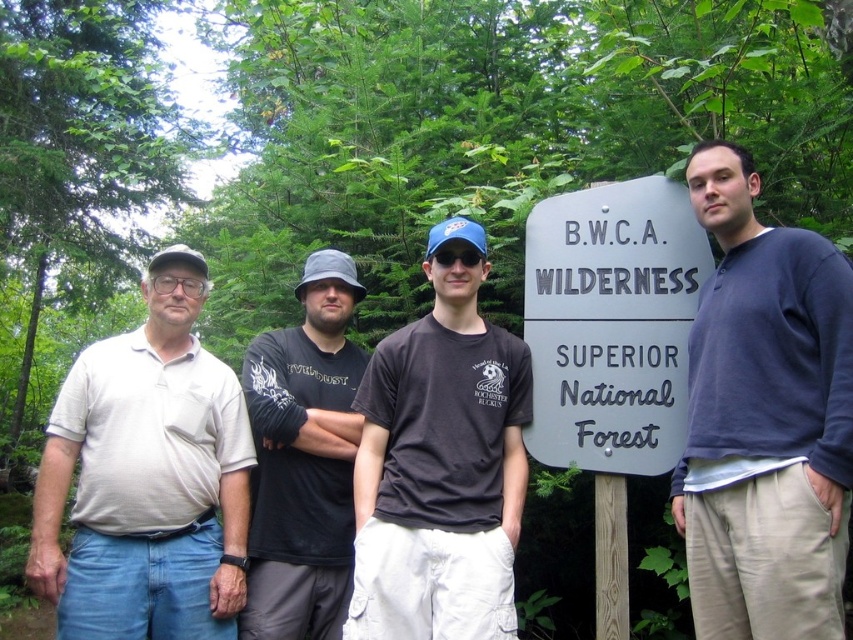
Between dark blue sweater at center and beige cotton polo shirt at left, which one is positioned higher?

Positioned higher is dark blue sweater at center.

Which of these two, dark blue sweater at center or beige cotton polo shirt at left, stands taller?

dark blue sweater at center is taller.

Which is behind, point (792, 424) or point (149, 616)?

Positioned behind is point (149, 616).

Where is `dark blue sweater at center`? dark blue sweater at center is located at coordinates (764, 419).

Between point (146, 394) and point (297, 467), which one is positioned behind?

The point (297, 467) is more distant.

Is point (192, 404) positioned in front of point (329, 596)?

No, it is behind (329, 596).

Locate an element on the screen. This screenshot has height=640, width=853. beige cotton polo shirt at left is located at coordinates (148, 477).

Who is positioned more to the right, beige cotton polo shirt at left or gray metal sign at center?

From the viewer's perspective, gray metal sign at center appears more on the right side.

Identify the location of beige cotton polo shirt at left. The height and width of the screenshot is (640, 853). (148, 477).